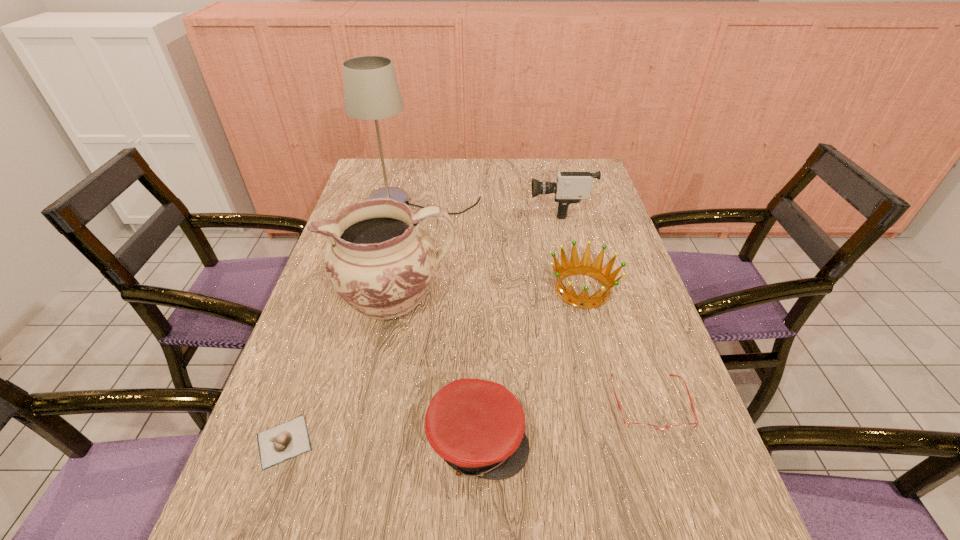
The image size is (960, 540). Find the location of `camcorder that is at the right edge`. camcorder that is at the right edge is located at coordinates (570, 187).

The width and height of the screenshot is (960, 540). I want to click on crown located at the right edge, so click(x=575, y=267).

Find the location of a particular element. The image size is (960, 540). spectacles that is positioned at the right edge is located at coordinates (637, 427).

This screenshot has width=960, height=540. In order to click on object situated at the far left corner in this screenshot , I will do [x=371, y=92].

Locate an element on the screen. This screenshot has height=540, width=960. vacant region at the far edge of the desktop is located at coordinates (515, 161).

The height and width of the screenshot is (540, 960). I want to click on free space at the left edge, so click(x=317, y=298).

Where is `blank area at the right edge`? The width and height of the screenshot is (960, 540). blank area at the right edge is located at coordinates (711, 469).

Where is `free location at the far right corner`? This screenshot has height=540, width=960. free location at the far right corner is located at coordinates (595, 184).

Find the location of a particular element. vacant area between the fifth shortest object and the cap is located at coordinates (518, 324).

Image resolution: width=960 pixels, height=540 pixels. I want to click on vacant space that is in between the cap and the shortest object, so click(x=381, y=441).